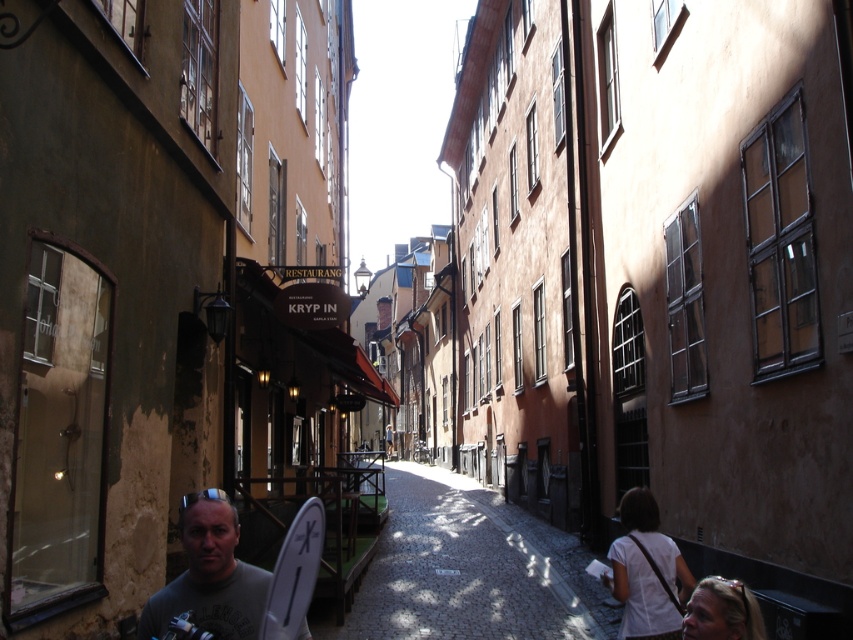
Is cobblestone street at center above gray matte t-shirt at lower center?

Actually, cobblestone street at center is below gray matte t-shirt at lower center.

Who is more distant from viewer, [428,568] or [260,620]?

Positioned behind is point [428,568].

Is point (527, 538) more distant than point (196, 544)?

Yes, it is.

The width and height of the screenshot is (853, 640). What are the coordinates of `cobblestone street at center` in the screenshot? It's located at (467, 568).